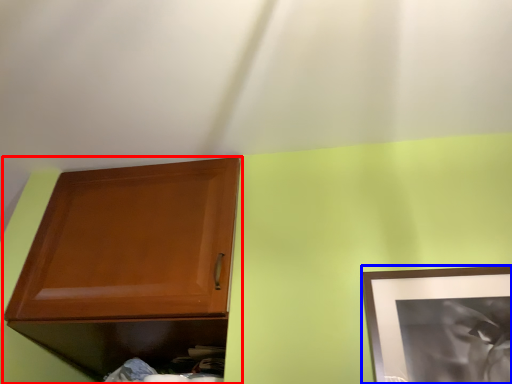
Question: Among these objects, which one is farthest to the camera, cabinetry (highlighted by a red box) or picture frame (highlighted by a blue box)?

Choices:
 (A) cabinetry
 (B) picture frame

Answer: (A)